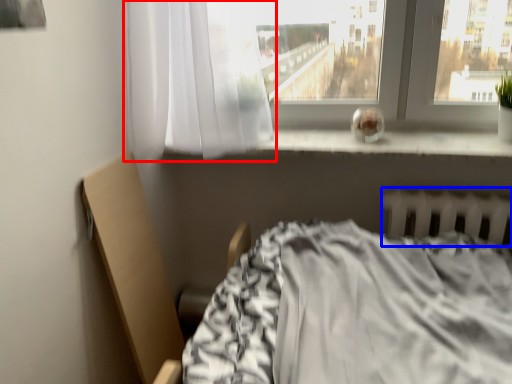
Question: Which object is further to the camera taking this photo, curtain (highlighted by a red box) or radiator (highlighted by a blue box)?

Choices:
 (A) curtain
 (B) radiator

Answer: (B)